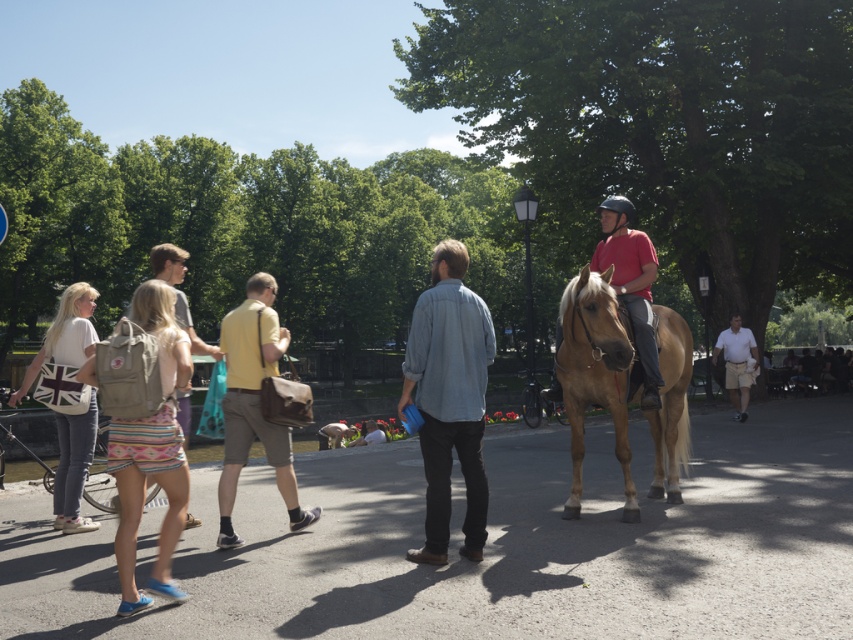
Question: Can you confirm if matte red shirt at center is thinner than light brown leather backpack at center-left?

Choices:
 (A) no
 (B) yes

Answer: (B)

Question: Can you confirm if yellow leather bag at center is wider than light brown shorts at right?

Choices:
 (A) no
 (B) yes

Answer: (B)

Question: Is light brown glossy horse at center positioned before yellow leather bag at center?

Choices:
 (A) yes
 (B) no

Answer: (B)

Question: Which object is positioned closest to the denim shirt at center?

Choices:
 (A) light brown leather backpack at center-left
 (B) yellow leather bag at center
 (C) light brown shorts at right

Answer: (B)

Question: Estimate the real-world distances between objects in this image. Which object is farther from the matte red shirt at center?

Choices:
 (A) light brown shorts at right
 (B) yellow leather bag at center
 (C) denim shirt at center
 (D) light brown glossy horse at center

Answer: (A)

Question: Considering the real-world distances, which object is farthest from the light brown leather backpack at center-left?

Choices:
 (A) matte red shirt at center
 (B) light brown glossy horse at center
 (C) yellow leather bag at center
 (D) denim shirt at center

Answer: (A)